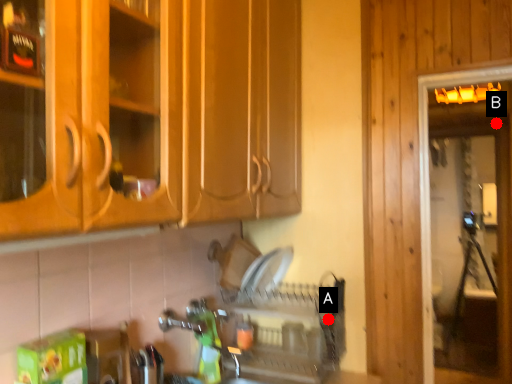
Question: Two points are circled on the image, labeled by A and B beside each circle. Which point is further to the camera?

Choices:
 (A) A is further
 (B) B is further

Answer: (B)